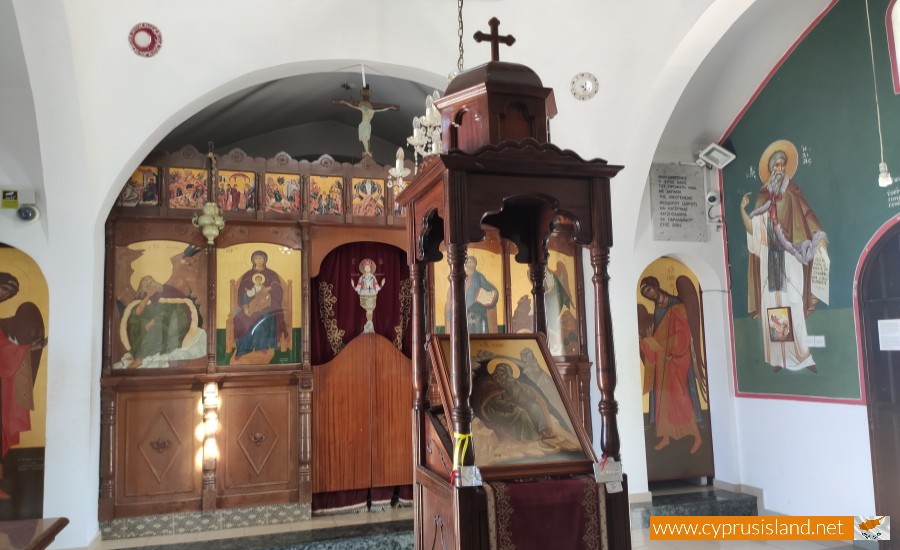
This screenshot has height=550, width=900. Identify the location of green paint. (823, 112).